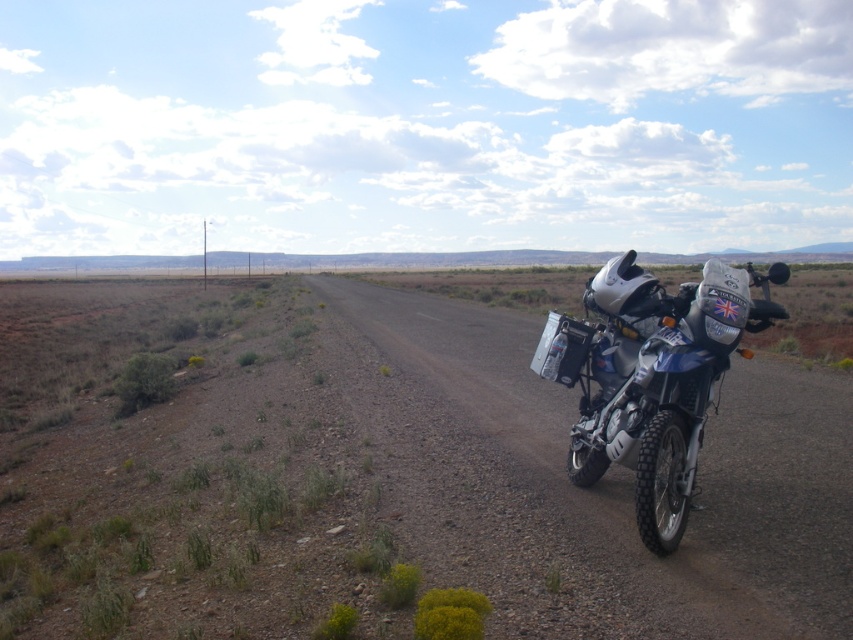
In the scene shown: Is dirt/gravel road at right wider than metallic blue motorcycle at right?

Yes.

Locate an element on the screen. This screenshot has height=640, width=853. dirt/gravel road at right is located at coordinates (619, 477).